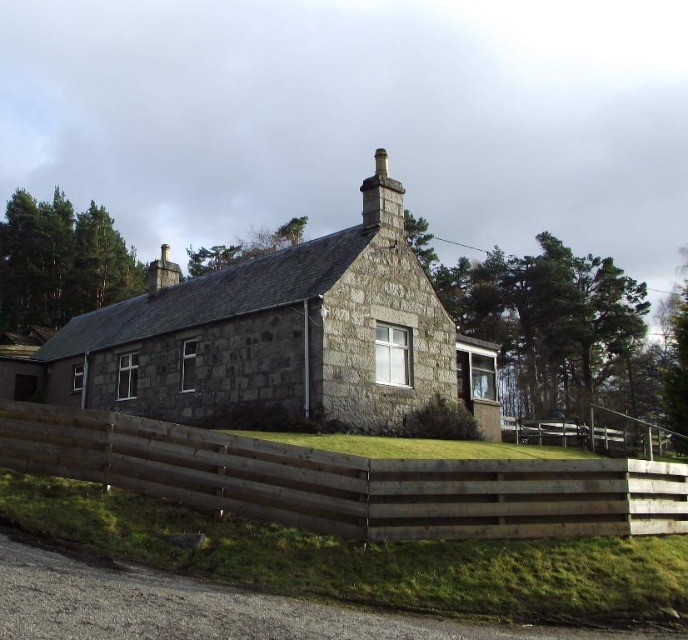
Between gray stone cottage at center and gray stone chimney at upper center, which one appears on the left side from the viewer's perspective?

gray stone cottage at center is more to the left.

Does gray stone cottage at center appear under gray stone chimney at upper center?

Yes, gray stone cottage at center is below gray stone chimney at upper center.

Is point (338, 305) more distant than point (365, 221)?

That is False.

This screenshot has width=688, height=640. What are the coordinates of `gray stone cottage at center` in the screenshot? It's located at (279, 340).

Which is above, brown wooden fence at lower center or gray stone chimney at upper center?

Positioned higher is gray stone chimney at upper center.

Is brown wooden fence at lower center taller than gray stone chimney at upper center?

In fact, brown wooden fence at lower center may be shorter than gray stone chimney at upper center.

Who is more forward, (50, 460) or (376, 157)?

Point (50, 460) is in front.

The height and width of the screenshot is (640, 688). Find the location of `brown wooden fence at lower center`. brown wooden fence at lower center is located at coordinates (347, 481).

From the picture: Between gray stone cottage at center and brown wooden fence at lower center, which one has more height?

gray stone cottage at center

Who is positioned more to the right, gray stone cottage at center or brown wooden fence at lower center?

Positioned to the right is brown wooden fence at lower center.

Is point (250, 276) positioned in front of point (363, 529)?

No.

Where is `gray stone cottage at center`? This screenshot has width=688, height=640. gray stone cottage at center is located at coordinates (279, 340).